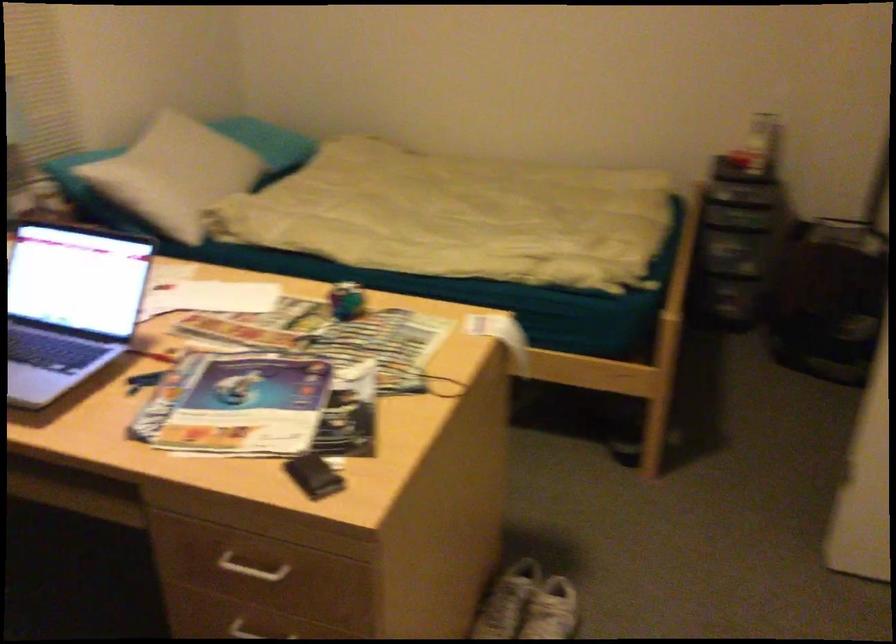
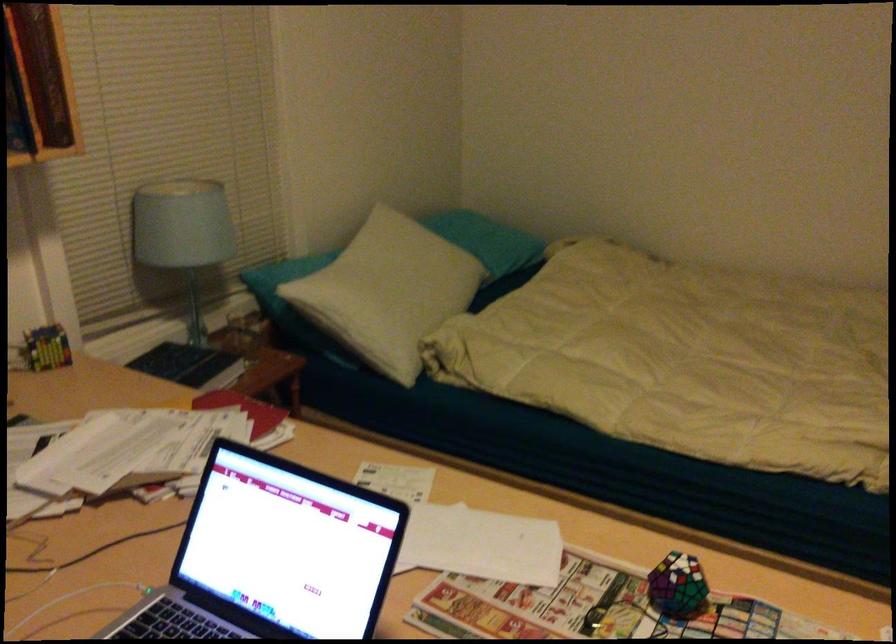
Find the pixel in the second image that matches [175,173] in the first image.

(389, 292)